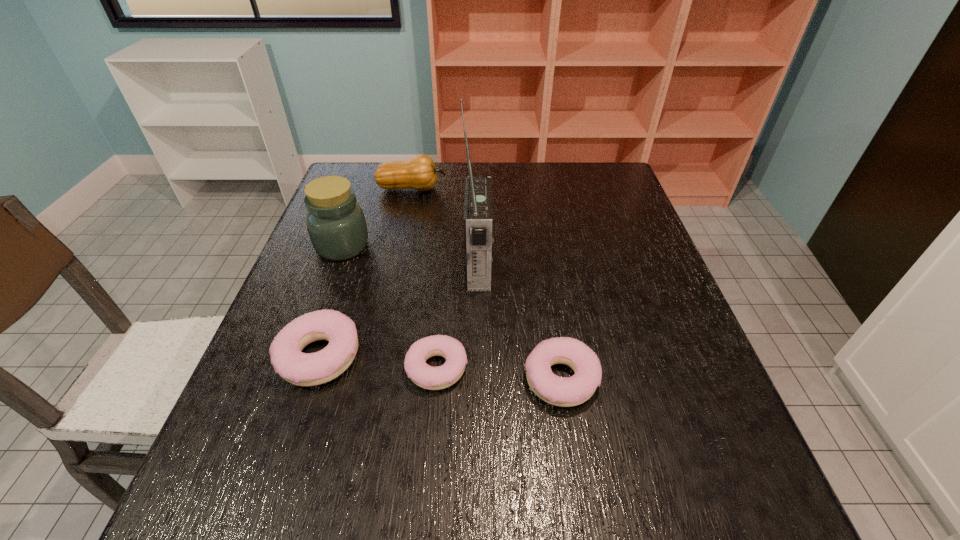
This screenshot has height=540, width=960. I want to click on the leftmost doughnut, so click(x=302, y=369).

Where is `the second doughnut from right to left`? The image size is (960, 540). the second doughnut from right to left is located at coordinates (432, 378).

Locate an element on the screen. This screenshot has width=960, height=540. the shortest object is located at coordinates (432, 378).

Where is `the rightmost doughnut`? This screenshot has width=960, height=540. the rightmost doughnut is located at coordinates (560, 391).

Where is `the fifth tallest object`? The height and width of the screenshot is (540, 960). the fifth tallest object is located at coordinates (560, 391).

Identify the location of the second tallest object. (336, 224).

Where is `the third tallest object`? Image resolution: width=960 pixels, height=540 pixels. the third tallest object is located at coordinates (419, 172).

This screenshot has height=540, width=960. In order to click on the farthest object in this screenshot , I will do (x=419, y=172).

I want to click on the tallest object, so click(478, 204).

I want to click on free space located 0.190m on the right of the leftmost doughnut, so click(453, 357).